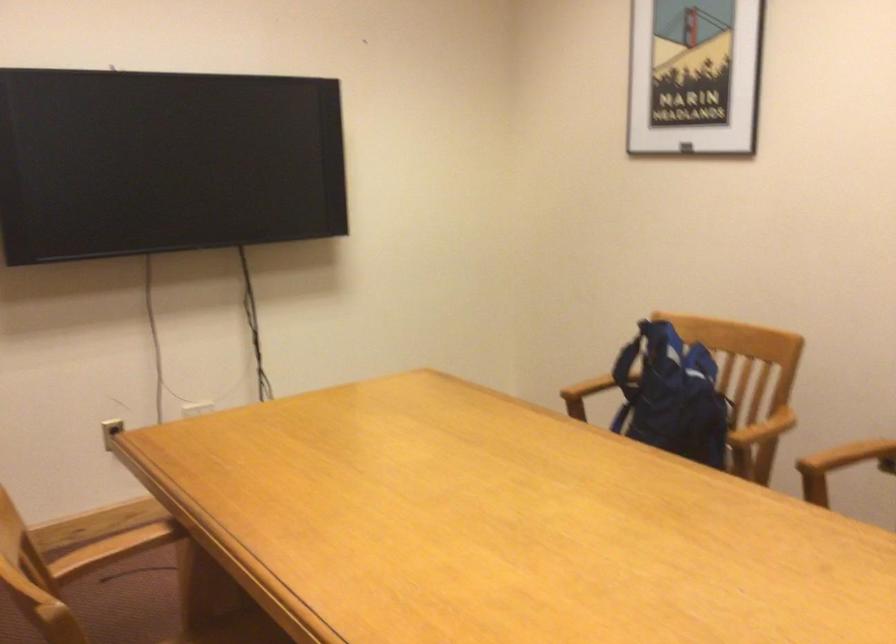
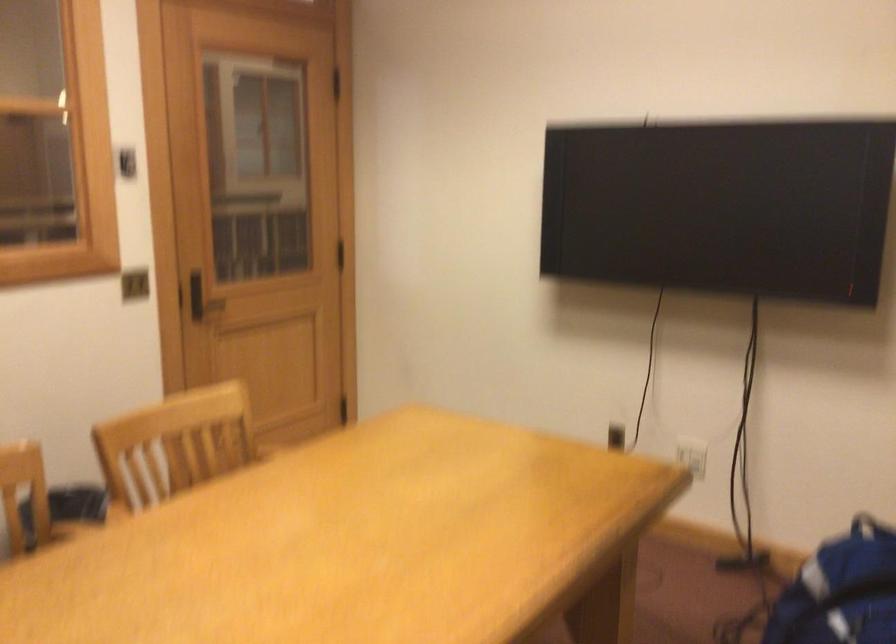
Question: I am providing you with two images of the same scene from different viewpoints. Which of the following objects are not visible in image2?

Choices:
 (A) orange handled brush
 (B) wooden chair armrest
 (C) black door handle
 (D) white power outlet

Answer: (B)